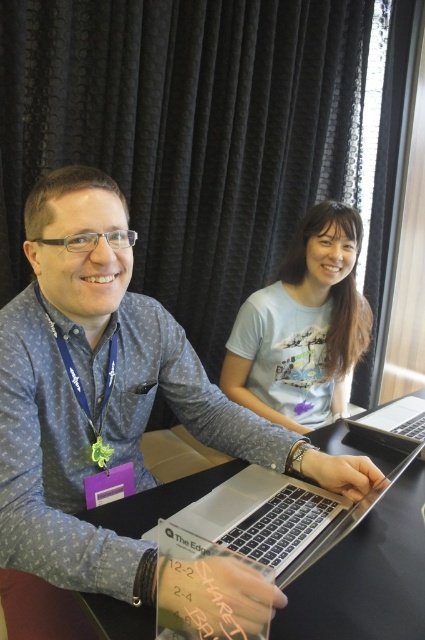
Question: Among these points, which one is nearest to the camera?

Choices:
 (A) (354, 416)
 (B) (240, 310)

Answer: (B)

Question: Does matte blue shirt at center appear on the left side of black plastic table at center?

Choices:
 (A) no
 (B) yes

Answer: (B)

Question: Does black plastic table at center lie behind sleek silver laptop at center?

Choices:
 (A) yes
 (B) no

Answer: (B)

Question: Which point is closer to the camera?

Choices:
 (A) (91, 605)
 (B) (308, 330)

Answer: (A)

Question: Which object is the farthest from the black plastic table at center?

Choices:
 (A) matte blue shirt at center
 (B) light blue cotton t-shirt at upper center
 (C) sleek silver laptop at center

Answer: (B)

Question: Is black plastic table at center further to the viewer compared to sleek silver laptop at center?

Choices:
 (A) yes
 (B) no

Answer: (B)